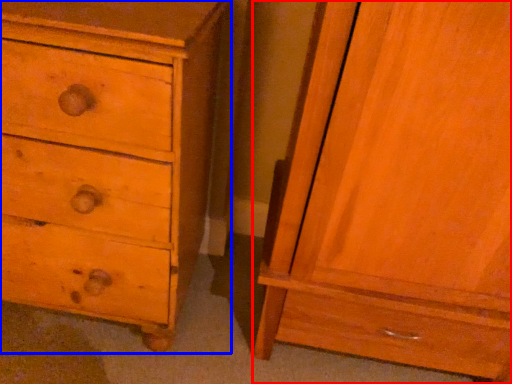
Question: Which of the following is the closest to the observer, nightstand (highlighted by a red box) or chest of drawers (highlighted by a blue box)?

Choices:
 (A) nightstand
 (B) chest of drawers

Answer: (A)